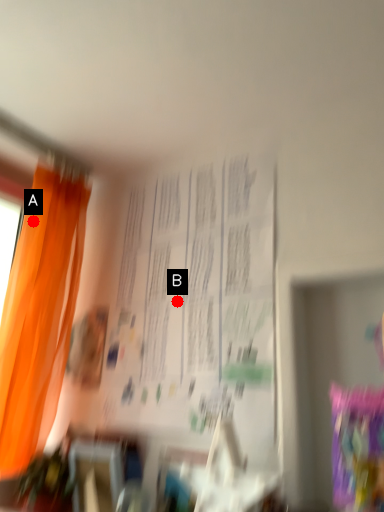
Question: Two points are circled on the image, labeled by A and B beside each circle. Which point is farther from the camera taking this photo?

Choices:
 (A) A is further
 (B) B is further

Answer: (A)